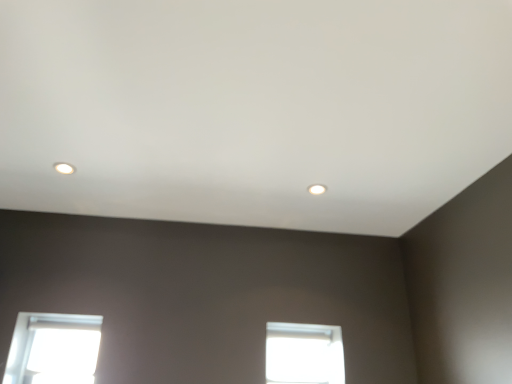
Question: In terms of width, does matte white light fixture at upper left, the 2th lighting positioned from the right, look wider or thinner when compared to transparent glass window at center, which is the second window from left to right?

Choices:
 (A) thin
 (B) wide

Answer: (B)

Question: In the image, is matte white light fixture at upper left, positioned as the second lighting in back-to-front order, on the left side or the right side of transparent glass window at center, positioned as the 1th window in right-to-left order?

Choices:
 (A) left
 (B) right

Answer: (A)

Question: Estimate the real-world distances between objects in this image. Which object is closer to the transparent glass window at lower left, which is the 2th window in right-to-left order?

Choices:
 (A) matte white light fixture at upper center, which is the 1th lighting from bottom to top
 (B) matte white light fixture at upper left, positioned as the first lighting in front-to-back order
 (C) transparent glass window at center, which is the second window from left to right

Answer: (B)

Question: Which object is the closest to the transparent glass window at lower left, the 1th window in the left-to-right sequence?

Choices:
 (A) matte white light fixture at upper center, which ranks as the first lighting in back-to-front order
 (B) matte white light fixture at upper left, positioned as the second lighting in back-to-front order
 (C) transparent glass window at center, which is the second window from left to right

Answer: (B)